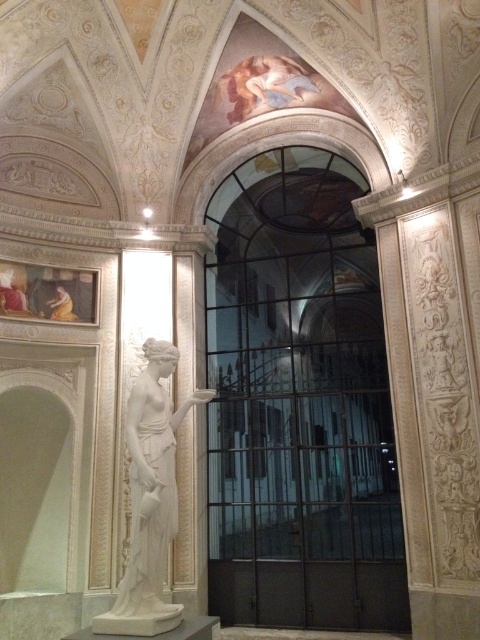
You are standing in the room and want to take a photo of the ceiling fresco. The camera you have can focus on objects up to 8 meters away. Is the point at coordinates point (314, 445) within the camera focus range?

Result: The distance of point (314, 445) from camera is 8.18 meters, which is beyond the camera focus range of 8 meters. Therefore, the camera cannot focus on that point.

You are standing in the classical interior space and want to view the white marble statue at center. Is the metallic gate at center blocking your view of it?

The metallic gate at center is positioned over white marble statue at center, so it is blocking the view of the statue.

You are standing in the center of the room and want to exit through the metallic gate at center. Which direction should you move to reach it?

Since the metallic gate at center is located at point (300, 403), you should move forward from the center to reach it.